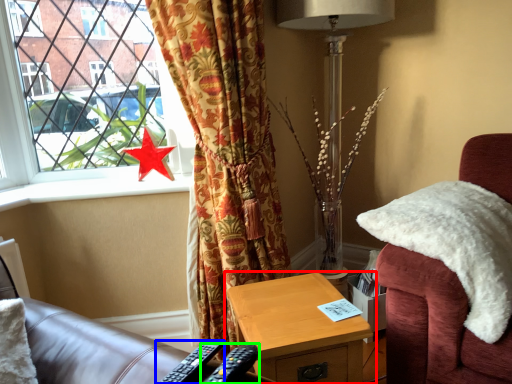
Question: Estimate the real-world distances between objects in this image. Which object is farther from nightstand (highlighted by a red box), remote control (highlighted by a blue box) or remote control (highlighted by a green box)?

Choices:
 (A) remote control
 (B) remote control

Answer: (A)